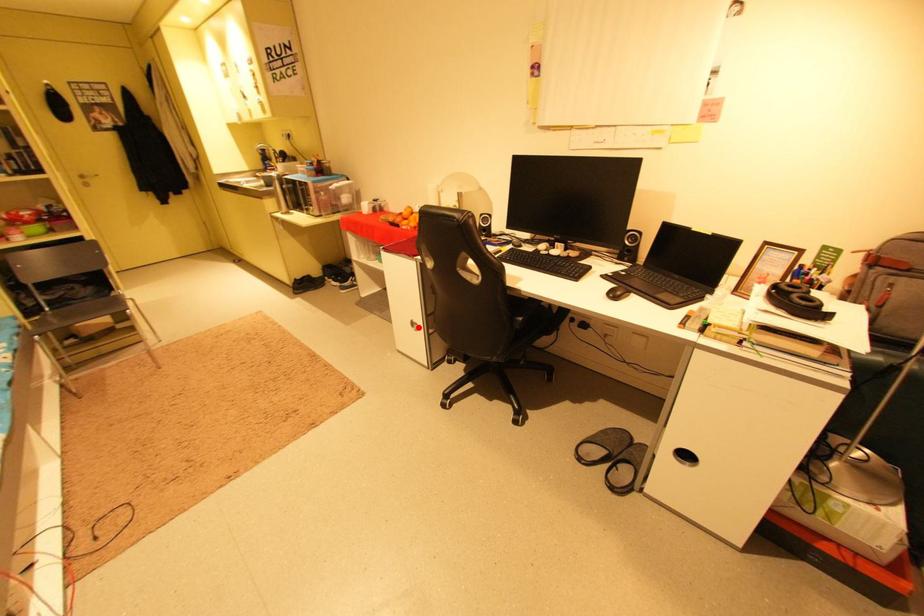
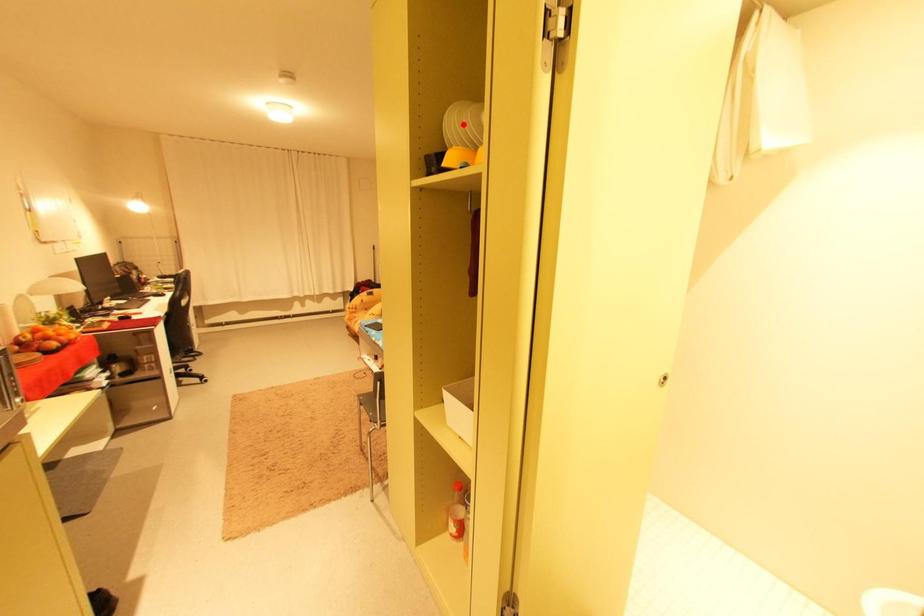
I am providing you with two images of the same scene from different viewpoints. A red point is marked on the first image and another point is marked on the second image. Are the points marked in image1 and image2 representing the same 3D position?

No